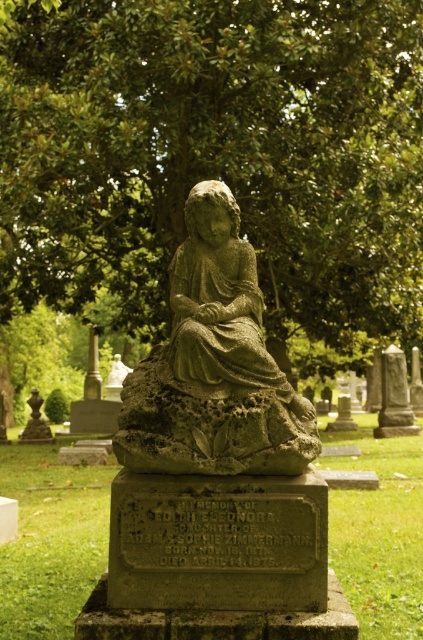
Who is taller, stone statue at center or green stone statue at center?

stone statue at center is taller.

Is point (131, 406) less distant than point (200, 340)?

No, (131, 406) is further to viewer.

This screenshot has height=640, width=423. Identify the location of stone statue at center. (214, 365).

Does green leafy tree at center have a larger size compared to stone statue at center?

Correct, green leafy tree at center is larger in size than stone statue at center.

Does point (35, 28) lie in front of point (211, 186)?

No, (35, 28) is further to viewer.

The width and height of the screenshot is (423, 640). What are the coordinates of `green leafy tree at center` in the screenshot? It's located at (216, 154).

Who is positioned more to the left, smooth gray stone at upper right or polished bronze vase at left?

Positioned to the left is polished bronze vase at left.

Which is in front, point (386, 429) or point (21, 440)?

Positioned in front is point (386, 429).

Find the location of a particular element. Image resolution: width=423 pixels, height=640 pixels. smooth gray stone at upper right is located at coordinates (395, 396).